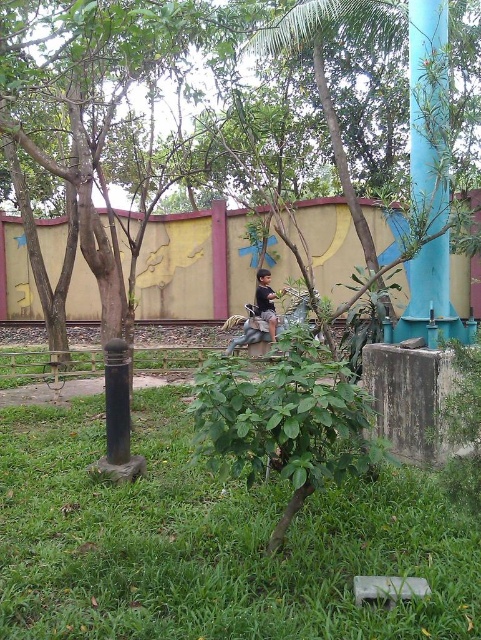
Does blue glossy pole at upper right have a greater width compared to black cotton shirt at center?

Indeed, blue glossy pole at upper right has a greater width compared to black cotton shirt at center.

Between blue glossy pole at upper right and black cotton shirt at center, which one is positioned higher?

blue glossy pole at upper right

Between point (438, 13) and point (269, 296), which one is positioned behind?

Positioned behind is point (269, 296).

You are a GUI agent. You are given a task and a screenshot of the screen. Output one action in this format:
    pyautogui.click(x=<x>, y=<y>)
    Task: Click on the blue glossy pole at upper right
    This screenshot has height=640, width=481.
    Given the screenshot: What is the action you would take?
    pyautogui.click(x=428, y=106)

Can you confirm if green grass at lower center is positioned above blue glossy pole at upper right?

Actually, green grass at lower center is below blue glossy pole at upper right.

Can you confirm if green grass at lower center is shorter than blue glossy pole at upper right?

Indeed, green grass at lower center has a lesser height compared to blue glossy pole at upper right.

Describe the element at coordinates (211, 541) in the screenshot. Image resolution: width=481 pixels, height=640 pixels. I see `green grass at lower center` at that location.

Locate an element on the screen. The height and width of the screenshot is (640, 481). green grass at lower center is located at coordinates (211, 541).

Is green grass at lower center positioned at the back of black cotton shirt at center?

That is False.

From the picture: Between green grass at lower center and black cotton shirt at center, which one is positioned lower?

green grass at lower center

Locate an element on the screen. The width and height of the screenshot is (481, 640). green grass at lower center is located at coordinates (211, 541).

What are the coordinates of `green grass at lower center` in the screenshot? It's located at (211, 541).